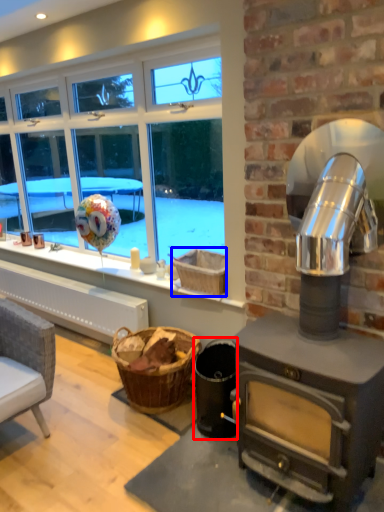
Question: Which point is further to the camera, appliance (highlighted by a red box) or basket (highlighted by a blue box)?

Choices:
 (A) appliance
 (B) basket

Answer: (B)